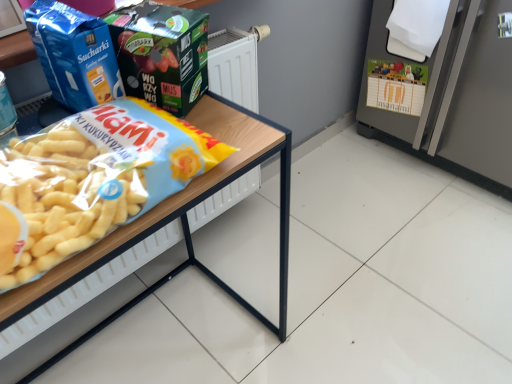
Question: Does matte green box at upper center, which is the first product from right to left, come behind satin silver refrigerator at right?

Choices:
 (A) no
 (B) yes

Answer: (A)

Question: Does matte green box at upper center, the second product in the left-to-right sequence, appear on the right side of satin silver refrigerator at right?

Choices:
 (A) no
 (B) yes

Answer: (A)

Question: From the image's perspective, is matte green box at upper center, which is the first product from right to left, located above satin silver refrigerator at right?

Choices:
 (A) no
 (B) yes

Answer: (A)

Question: Considering the relative sizes of matte green box at upper center, which is the first product from right to left, and satin silver refrigerator at right in the image provided, is matte green box at upper center, which is the first product from right to left, wider than satin silver refrigerator at right?

Choices:
 (A) no
 (B) yes

Answer: (A)

Question: Is matte green box at upper center, which is the first product from right to left, touching satin silver refrigerator at right?

Choices:
 (A) no
 (B) yes

Answer: (A)

Question: Relative to satin silver refrigerator at right, is wooden table at left in front or behind?

Choices:
 (A) front
 (B) behind

Answer: (A)

Question: Would you say wooden table at left is to the left or to the right of satin silver refrigerator at right in the picture?

Choices:
 (A) left
 (B) right

Answer: (A)

Question: Is wooden table at left wider or thinner than satin silver refrigerator at right?

Choices:
 (A) thin
 (B) wide

Answer: (A)

Question: Considering the positions of wooden table at left and satin silver refrigerator at right in the image, is wooden table at left bigger or smaller than satin silver refrigerator at right?

Choices:
 (A) big
 (B) small

Answer: (B)

Question: Based on their positions, is wooden table at left located to the left or right of matte green box at upper center, which is the first product from right to left?

Choices:
 (A) left
 (B) right

Answer: (A)

Question: Considering their positions, is wooden table at left located in front of or behind matte green box at upper center, which is the first product from right to left?

Choices:
 (A) behind
 (B) front

Answer: (B)

Question: From the image's perspective, is wooden table at left positioned above or below matte green box at upper center, the second product in the left-to-right sequence?

Choices:
 (A) above
 (B) below

Answer: (B)

Question: From a real-world perspective, relative to matte green box at upper center, the second product in the left-to-right sequence, is wooden table at left vertically above or below?

Choices:
 (A) above
 (B) below

Answer: (B)

Question: Considering the positions of point (156, 23) and point (481, 41), is point (156, 23) closer or farther from the camera than point (481, 41)?

Choices:
 (A) closer
 (B) farther

Answer: (A)

Question: In terms of height, does matte green box at upper center, which is the first product from right to left, look taller or shorter compared to satin silver refrigerator at right?

Choices:
 (A) tall
 (B) short

Answer: (B)